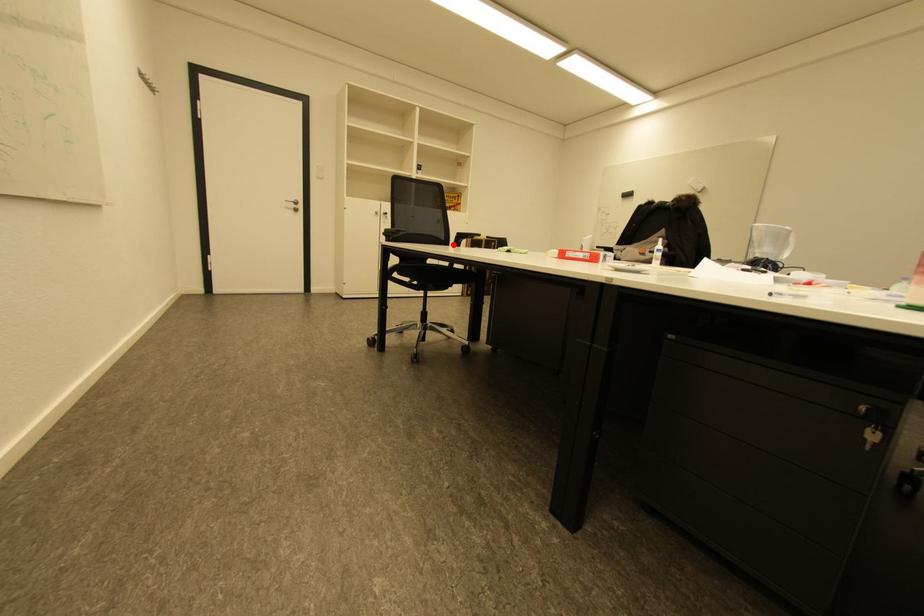
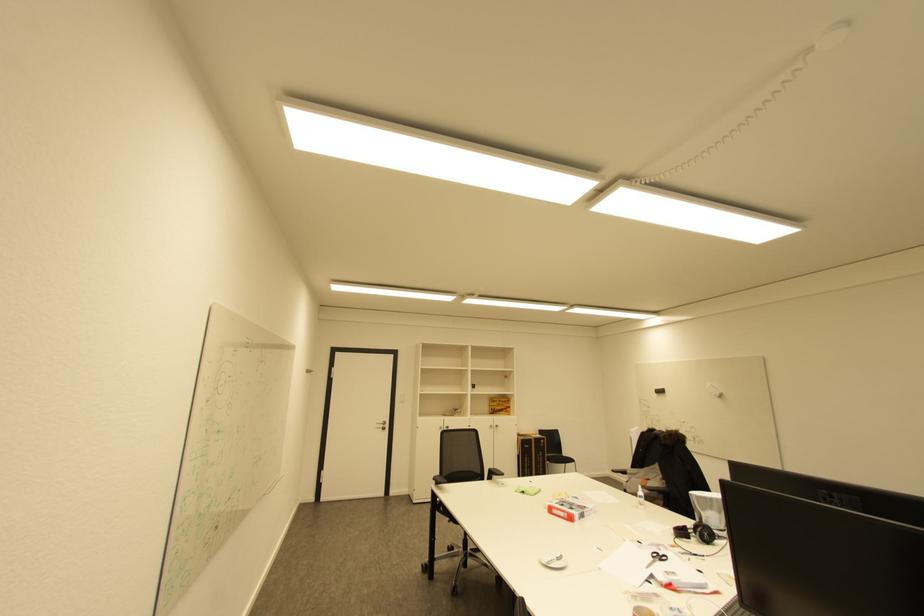
Question: I am providing you with two images of the same scene from different viewpoints. In image1, a red point is highlighted. Considering the same 3D point in image2, which of the following is correct?

Choices:
 (A) It is closer
 (B) It is farther

Answer: (B)